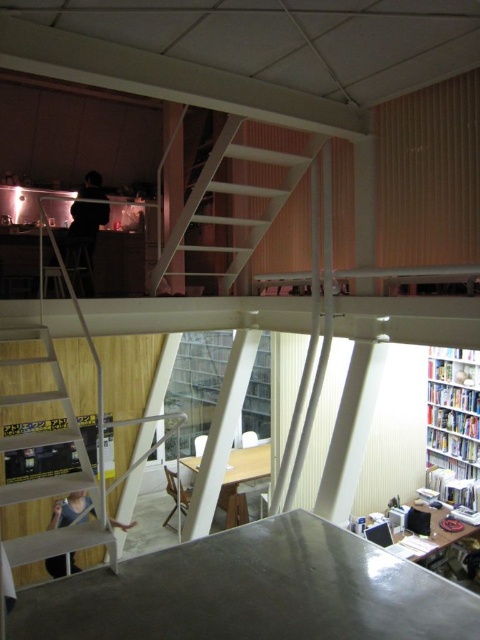
You are standing at the entrance of the office space and need to reach the upper level. The wooden staircase at lower left is your only option. Can you confirm its exact position relative to the entrance?

The wooden staircase at lower left is located at point 2D coordinates of (52,476), which is to the left side of the entrance, making it the correct path to the upper level.

You are an office worker who needs to reach a book on the top shelf of the white glossy bookshelf at right. You have a white metal ladder at center. Considering their sizes, will the ladder be able to reach the top of the bookshelf?

The white metal ladder at center is larger in size compared to the white glossy bookshelf at right, so it should be able to reach the top of the bookshelf.